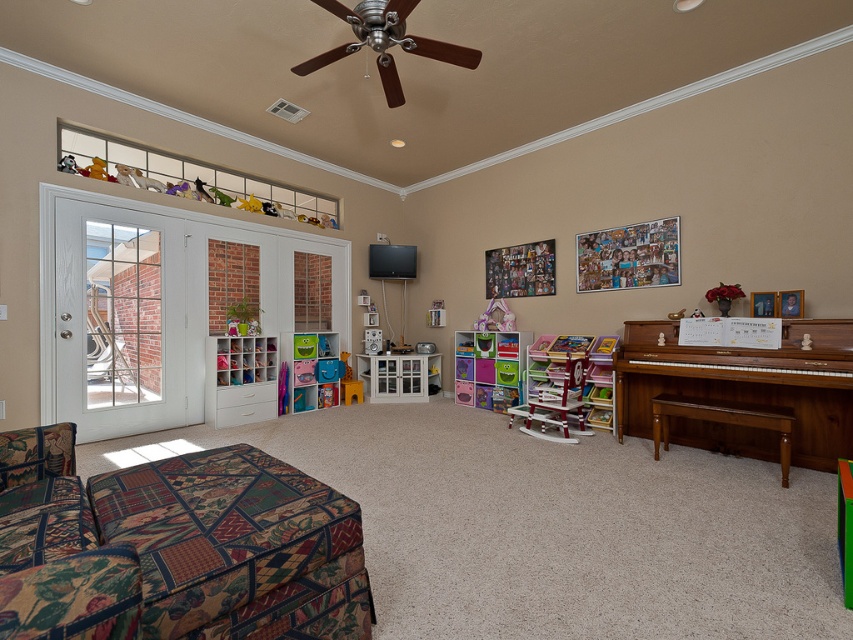
Question: Which point appears farthest from the camera in this image?

Choices:
 (A) [x=788, y=394]
 (B) [x=161, y=632]
 (C) [x=468, y=388]
 (D) [x=76, y=355]

Answer: (C)

Question: Considering the real-world distances, which object is closest to the multicolored plastic toy storage at center?

Choices:
 (A) white wood glass door at left
 (B) patterned fabric couch at lower left

Answer: (A)

Question: Is patterned fabric couch at lower left smaller than mahogany polished piano at right?

Choices:
 (A) yes
 (B) no

Answer: (A)

Question: Which of the following is the farthest from the observer?

Choices:
 (A) (90, 483)
 (B) (645, 412)
 (C) (84, 412)

Answer: (B)

Question: Does patterned fabric couch at lower left have a larger size compared to white wood glass door at left?

Choices:
 (A) yes
 (B) no

Answer: (B)

Question: Does patterned fabric couch at lower left have a larger size compared to mahogany polished piano at right?

Choices:
 (A) yes
 (B) no

Answer: (B)